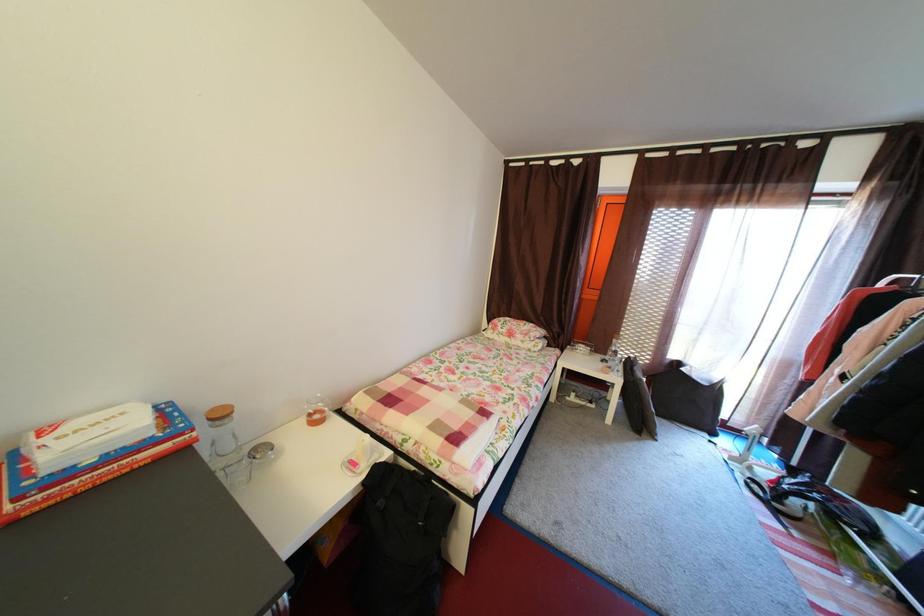
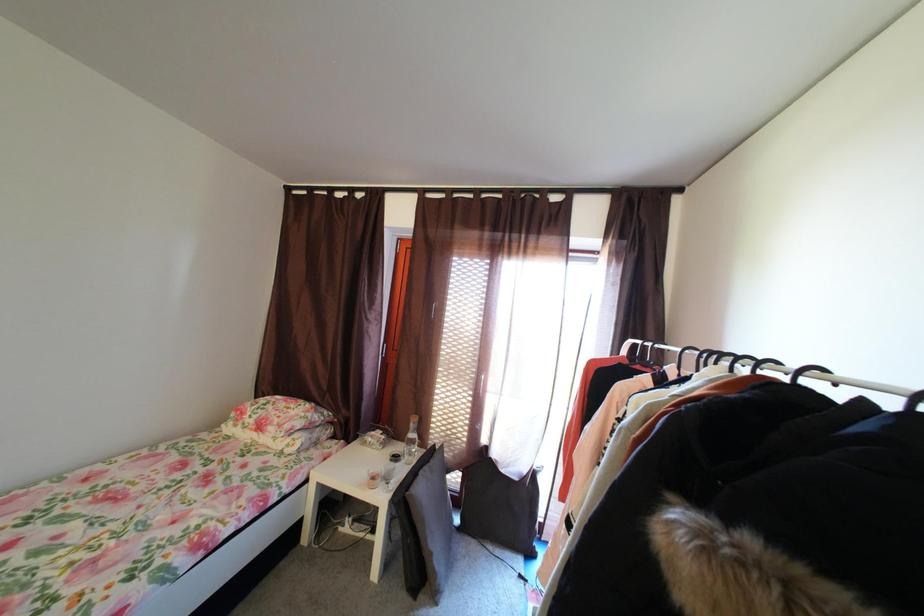
The images are taken continuously from a first-person perspective. In which direction are you moving?

The cameraman walked toward right, forward.